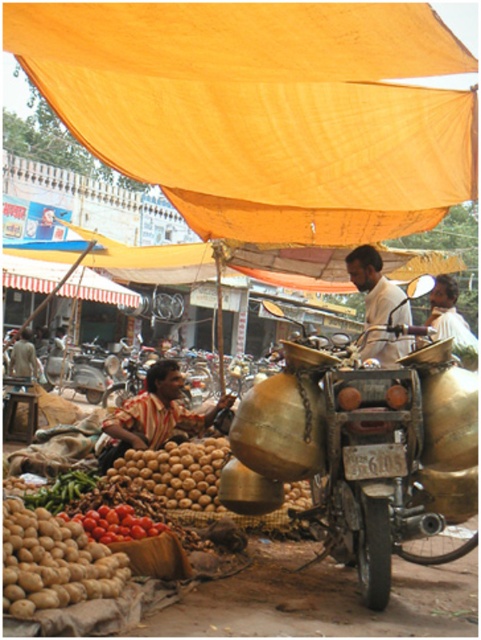
Who is positioned more to the right, white matte shirt at center or shiny red tomatoes at lower left?

From the viewer's perspective, white matte shirt at center appears more on the right side.

Does white matte shirt at center appear under shiny red tomatoes at lower left?

No, white matte shirt at center is not below shiny red tomatoes at lower left.

Describe the element at coordinates (376, 288) in the screenshot. I see `white matte shirt at center` at that location.

This screenshot has height=640, width=481. What are the coordinates of `white matte shirt at center` in the screenshot? It's located at (376, 288).

Between smooth brown potatoes at lower left and white matte shirt at center, which one is positioned lower?

smooth brown potatoes at lower left

Does smooth brown potatoes at lower left come behind white matte shirt at center?

Yes.

Which is behind, point (164, 493) or point (374, 353)?

Point (164, 493)

The height and width of the screenshot is (640, 481). Identify the location of smooth brown potatoes at lower left. (177, 472).

Is point (173, 496) in front of point (110, 508)?

No.

Who is lower down, smooth brown potatoes at lower left or shiny red tomatoes at lower left?

shiny red tomatoes at lower left is lower down.

You are a GUI agent. You are given a task and a screenshot of the screen. Output one action in this format:
    pyautogui.click(x=<x>, y=<y>)
    Task: Click on the smooth brown potatoes at lower left
    This screenshot has height=640, width=481.
    Given the screenshot: What is the action you would take?
    pyautogui.click(x=177, y=472)

Locate an element on the screen. Image resolution: width=481 pixels, height=640 pixels. smooth brown potatoes at lower left is located at coordinates (177, 472).